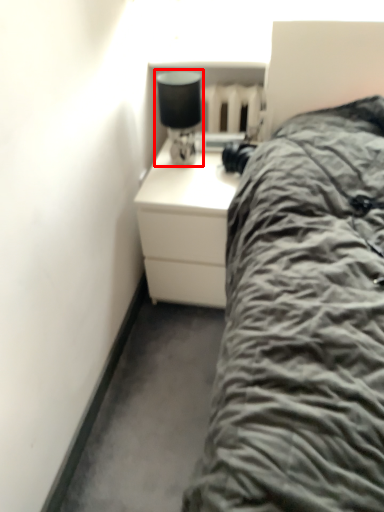
Question: From the image, what is the correct spatial relationship of bedside lamp (annotated by the red box) in relation to chest of drawers?

Choices:
 (A) left
 (B) right

Answer: (A)